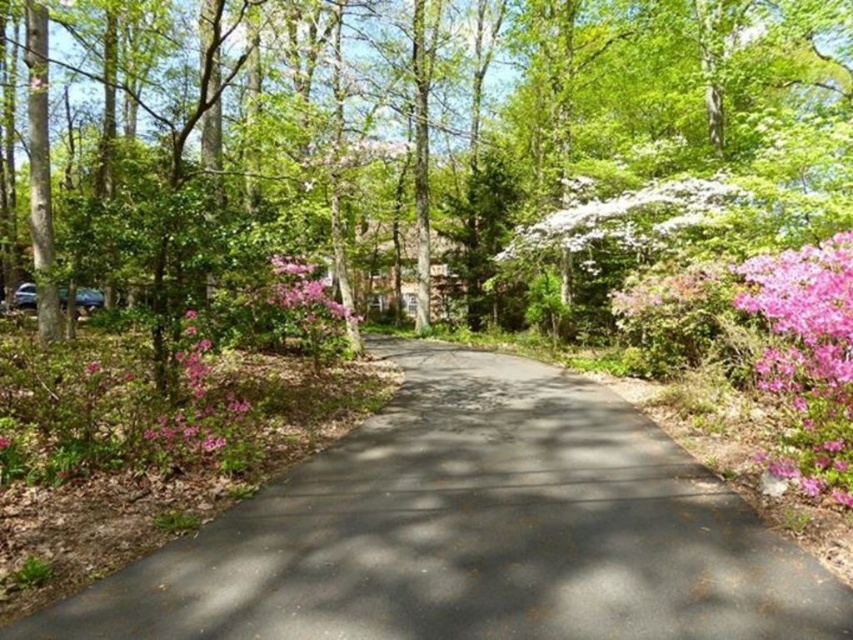
Question: Which of the following is the closest to the observer?

Choices:
 (A) (798, 636)
 (B) (306, 301)

Answer: (A)

Question: Which of the following is the closest to the observer?

Choices:
 (A) (816, 250)
 (B) (676, 198)
 (C) (207, 371)
 (D) (322, 294)

Answer: (A)

Question: Can you confirm if pink matte flowers at left is positioned to the left of pink matte flower at center-left?

Choices:
 (A) no
 (B) yes

Answer: (B)

Question: Does pink matte flower at right appear on the right side of white fluffy flowers at center?

Choices:
 (A) no
 (B) yes

Answer: (A)

Question: From the image, what is the correct spatial relationship of green leafy tree at center in relation to pink matte flower at center-left?

Choices:
 (A) left
 (B) right

Answer: (B)

Question: Which of the following is the closest to the observer?

Choices:
 (A) pink matte flower at right
 (B) white fluffy flowers at center

Answer: (A)